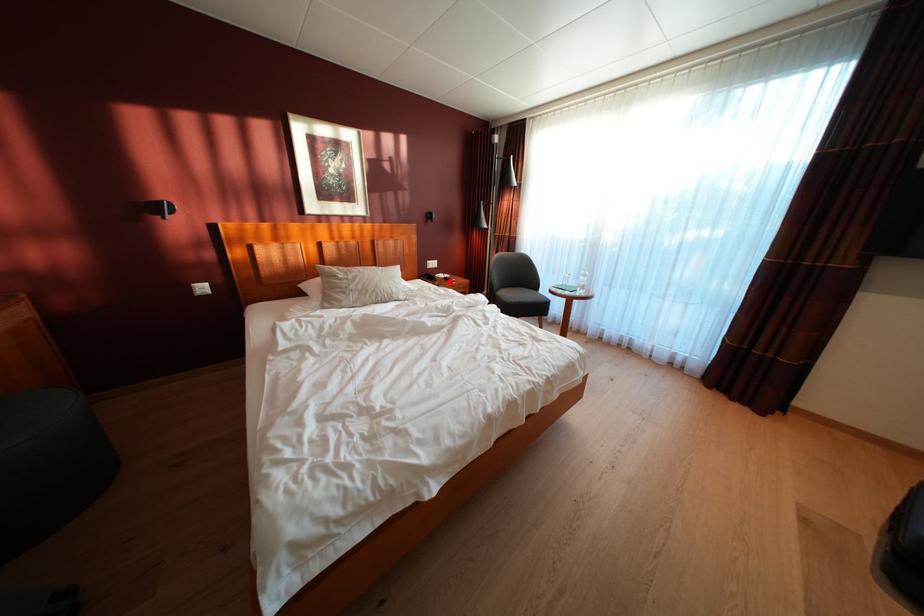
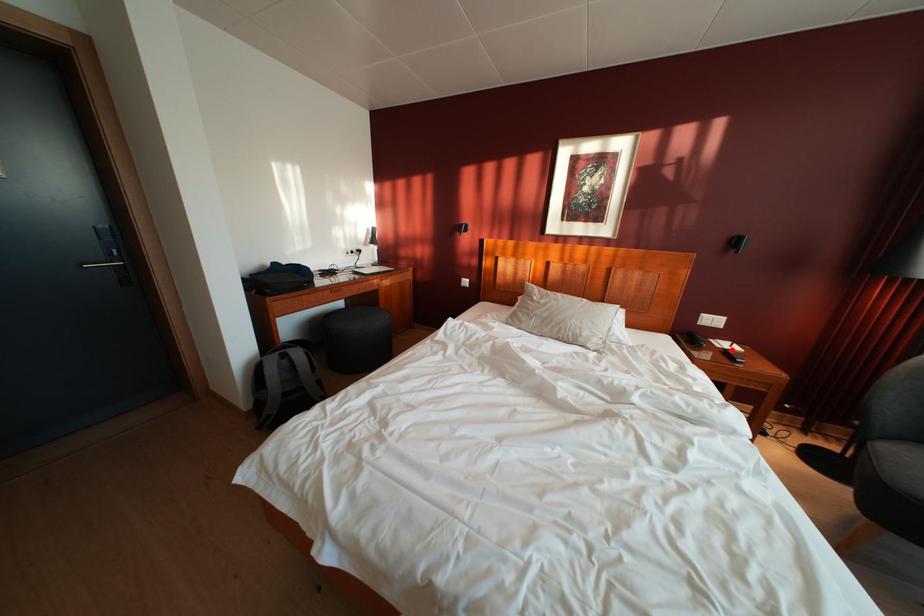
I am providing you with two images of the same scene from different viewpoints. A red point is marked on the first image and another point is marked on the second image. Does the point marked in image1 correspond to the same location as the one in image2?

Yes